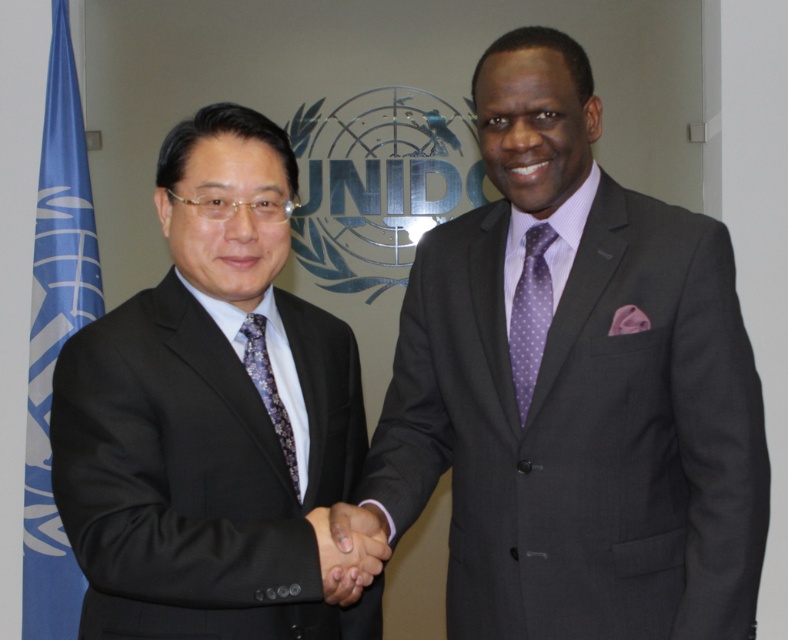
Question: Does matte black suit at left appear on the right side of black satin hand at center?

Choices:
 (A) yes
 (B) no

Answer: (B)

Question: Among these points, which one is farthest from the camera?

Choices:
 (A) (528, 298)
 (B) (103, 509)

Answer: (A)

Question: Which of the following is the closest to the observer?

Choices:
 (A) matte black suit at left
 (B) black satin hand at center
 (C) dark gray suit at center

Answer: (A)

Question: Is matte black suit at left to the left of matte purple tie at center from the viewer's perspective?

Choices:
 (A) yes
 (B) no

Answer: (A)

Question: Is blue fabric flag at left above matte purple tie at center?

Choices:
 (A) yes
 (B) no

Answer: (A)

Question: Considering the real-world distances, which object is farthest from the dark gray suit at center?

Choices:
 (A) black satin hand at center
 (B) blue fabric flag at left
 (C) matte black suit at left

Answer: (B)